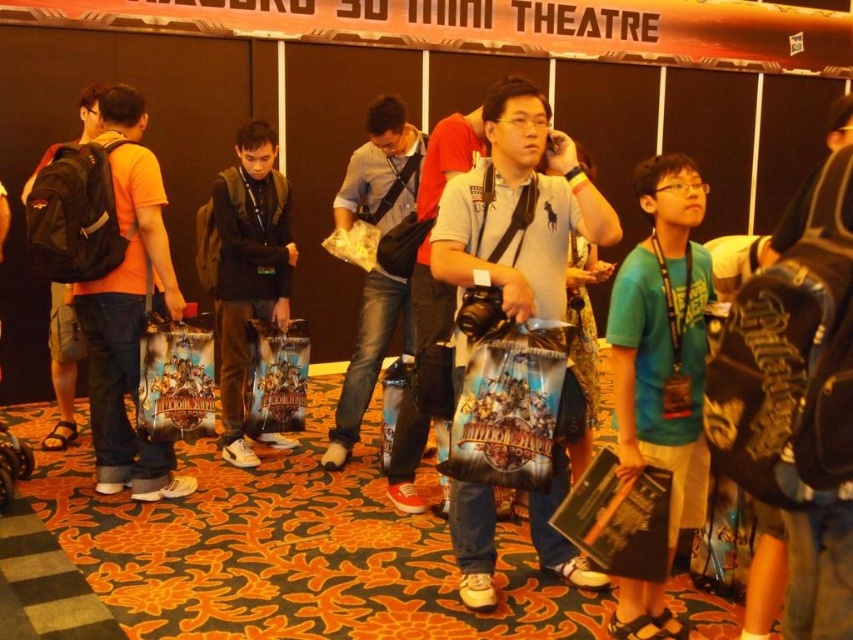
Question: Which object appears farthest from the camera in this image?

Choices:
 (A) green matte t-shirt at center
 (B) black matte backpack at center
 (C) matte black bag at center

Answer: (B)

Question: Considering the real-world distances, which object is closest to the matte black backpack at left?

Choices:
 (A) matte black bag at center
 (B) green matte t-shirt at center
 (C) black matte backpack at center

Answer: (C)

Question: In this image, where is gray cotton polo shirt at center located relative to orange matte backpack at left?

Choices:
 (A) below
 (B) above

Answer: (B)

Question: Does green matte t-shirt at center appear over orange matte backpack at left?

Choices:
 (A) no
 (B) yes

Answer: (A)

Question: In this image, where is green matte t-shirt at center located relative to orange matte backpack at left?

Choices:
 (A) above
 (B) below

Answer: (B)

Question: Which object is closer to the camera taking this photo?

Choices:
 (A) green matte t-shirt at center
 (B) orange matte backpack at left
 (C) matte black backpack at left

Answer: (A)